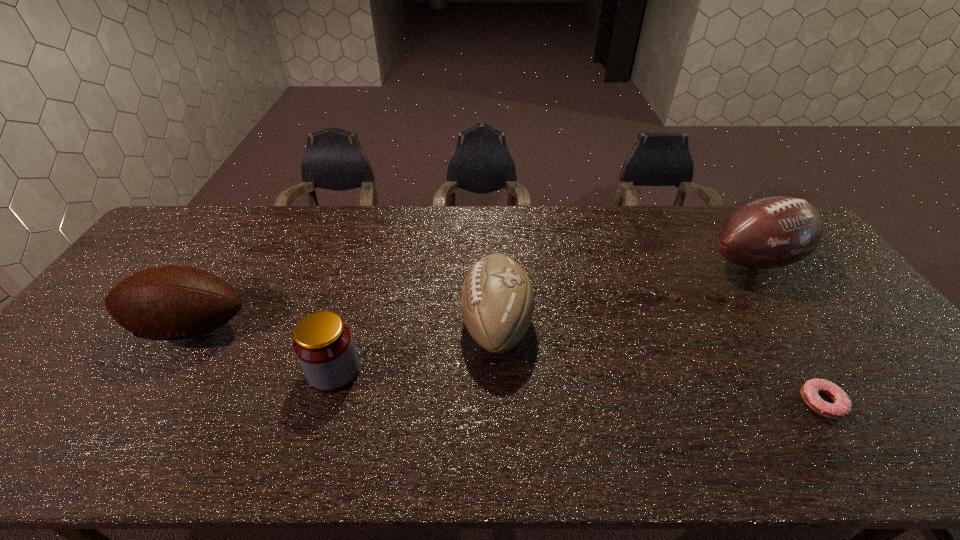
Find the location of a particular element. Image resolution: width=960 pixels, height=540 pixels. vacant point at the far left corner is located at coordinates (221, 205).

Locate an element on the screen. Image resolution: width=960 pixels, height=540 pixels. vacant region between the third object from right to left and the fourth object from right to left is located at coordinates (415, 348).

Locate an element on the screen. free area in between the doughnut and the fourth tallest object is located at coordinates (578, 387).

Find the location of a particular element. empty space that is in between the doughnut and the leftmost object is located at coordinates (506, 366).

Where is `vacant space in between the rightmost football (American) and the jar`? The image size is (960, 540). vacant space in between the rightmost football (American) and the jar is located at coordinates (544, 316).

Identify the location of vacant area that lies between the rightmost football (American) and the shortest object. 788,332.

In order to click on vacant space in between the doughnut and the second football (American) from right to left in this screenshot , I will do `click(659, 364)`.

Where is `unoccupied position between the rightmost football (American) and the third object from right to left`? Image resolution: width=960 pixels, height=540 pixels. unoccupied position between the rightmost football (American) and the third object from right to left is located at coordinates (625, 293).

This screenshot has height=540, width=960. Identify the location of empty location between the shortest object and the rightmost football (American). (788, 332).

At what (x,y) coordinates should I click in order to perform the action: click on free spot between the leftmost object and the shortest object. Please return your answer as a coordinate pair (x, y). This screenshot has width=960, height=540. Looking at the image, I should click on click(x=506, y=366).